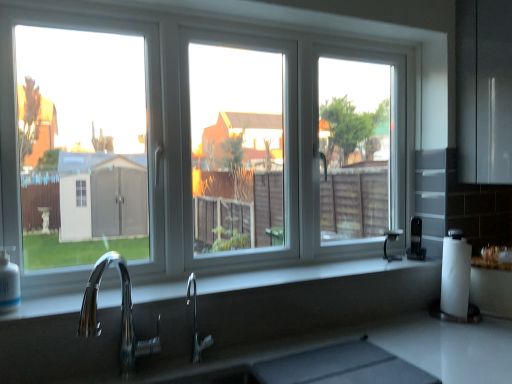
What are the coordinates of `vacant area on top of white plastic window at center (from a real-world perspective)` in the screenshot? It's located at (270, 22).